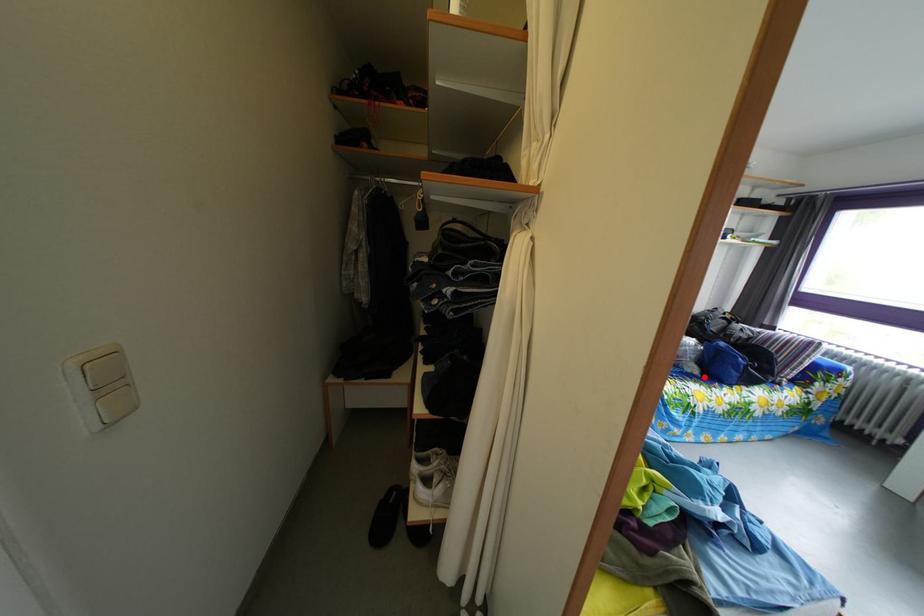
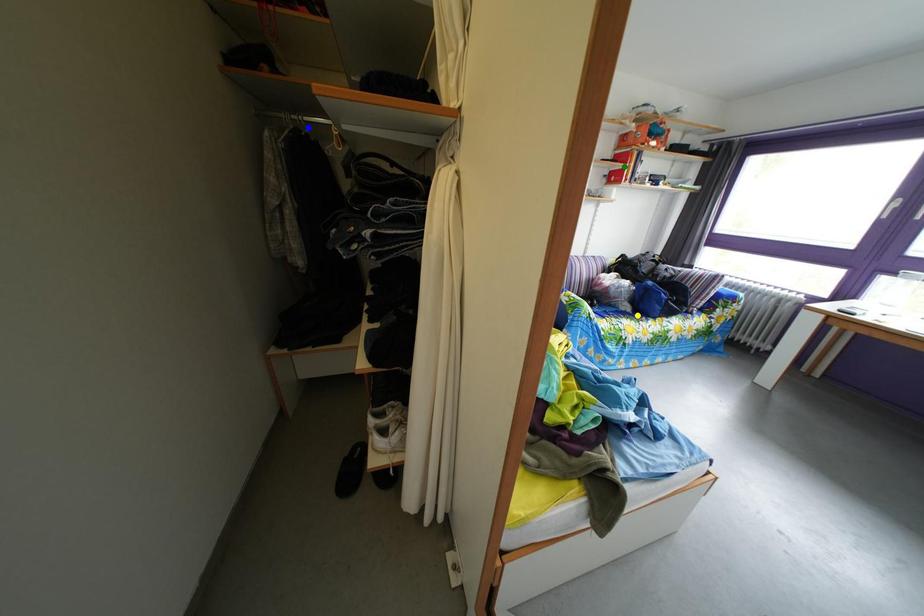
Question: I am providing you with two images of the same scene from different viewpoints. A red point is marked on the first image. You are given multiple points on the second image. Which point in image 2 represents the same 3d spot as the red point in image 1?

Choices:
 (A) blue point
 (B) green point
 (C) yellow point

Answer: (C)